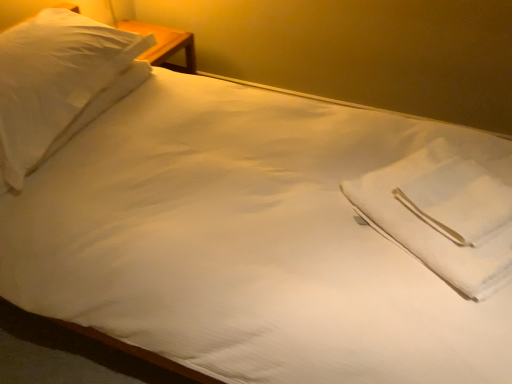
What do you see at coordinates (442, 216) in the screenshot? The width and height of the screenshot is (512, 384). I see `white cotton cloth at center` at bounding box center [442, 216].

You are a GUI agent. You are given a task and a screenshot of the screen. Output one action in this format:
    pyautogui.click(x=<x>, y=<y>)
    Task: Click on the white cotton cloth at center
    
    Given the screenshot: What is the action you would take?
    coord(442,216)

Where is `white soft pillow at upper left`? Image resolution: width=512 pixels, height=384 pixels. white soft pillow at upper left is located at coordinates (59, 84).

This screenshot has height=384, width=512. What do you see at coordinates (59, 84) in the screenshot?
I see `white soft pillow at upper left` at bounding box center [59, 84].

Find the location of a particular element. This screenshot has width=512, height=384. white cotton cloth at center is located at coordinates (442, 216).

Consider the image. Would you say white soft pillow at upper left is to the left or to the right of white cotton cloth at center in the picture?

Clearly, white soft pillow at upper left is on the left of white cotton cloth at center in the image.

Is white soft pillow at upper left positioned behind white cotton cloth at center?

Yes.

Which is behind, point (33, 26) or point (379, 171)?

The point (33, 26) is behind.

From the image's perspective, relative to white cotton cloth at center, is white soft pillow at upper left above or below?

Based on their image positions, white soft pillow at upper left is located above white cotton cloth at center.

From a real-world perspective, who is located lower, white soft pillow at upper left or white cotton cloth at center?

From a 3D spatial view, white soft pillow at upper left is below.

Based on the photo, considering the sizes of white soft pillow at upper left and white cotton cloth at center in the image, is white soft pillow at upper left wider or thinner than white cotton cloth at center?

Clearly, white soft pillow at upper left has more width compared to white cotton cloth at center.

Can you confirm if white soft pillow at upper left is shorter than white cotton cloth at center?

Incorrect, the height of white soft pillow at upper left does not fall short of that of white cotton cloth at center.

Considering the sizes of objects white soft pillow at upper left and white cotton cloth at center in the image provided, who is smaller, white soft pillow at upper left or white cotton cloth at center?

With smaller size is white cotton cloth at center.

Choose the correct answer: Is white soft pillow at upper left inside white cotton cloth at center or outside it?

white soft pillow at upper left exists outside the volume of white cotton cloth at center.

From the picture: Is white soft pillow at upper left directly adjacent to white cotton cloth at center?

No, white soft pillow at upper left is not next to white cotton cloth at center.

Does white soft pillow at upper left turn towards white cotton cloth at center?

No.

Can you tell me how much white soft pillow at upper left and white cotton cloth at center differ in facing direction?

The angular difference between white soft pillow at upper left and white cotton cloth at center is 180 degrees.

At what (x,y) coordinates should I click in order to perform the action: click on pillow that appears below the white cotton cloth at center (from a real-world perspective). Please return your answer as a coordinate pair (x, y). This screenshot has height=384, width=512. Looking at the image, I should click on 59,84.

Does white cotton cloth at center appear on the left side of white soft pillow at upper left?

In fact, white cotton cloth at center is to the right of white soft pillow at upper left.

Considering the relative positions of white cotton cloth at center and white soft pillow at upper left in the image provided, is white cotton cloth at center in front of white soft pillow at upper left?

Yes.

Considering the points (414, 169) and (31, 120), which point is behind, point (414, 169) or point (31, 120)?

Point (414, 169)

From the image's perspective, between white cotton cloth at center and white soft pillow at upper left, which one is located above?

white soft pillow at upper left, from the image's perspective.

From a real-world perspective, is white cotton cloth at center located beneath white soft pillow at upper left?

Incorrect, from a real-world perspective, white cotton cloth at center is higher than white soft pillow at upper left.

Is white cotton cloth at center wider or thinner than white soft pillow at upper left?

white cotton cloth at center is thinner than white soft pillow at upper left.

Considering the sizes of objects white cotton cloth at center and white soft pillow at upper left in the image provided, who is shorter, white cotton cloth at center or white soft pillow at upper left?

white cotton cloth at center is shorter.

Considering the relative sizes of white cotton cloth at center and white soft pillow at upper left in the image provided, is white cotton cloth at center smaller than white soft pillow at upper left?

Yes.

Do you think white cotton cloth at center is within white soft pillow at upper left, or outside of it?

The correct answer is: outside.

Is white cotton cloth at center beside white soft pillow at upper left?

There is a gap between white cotton cloth at center and white soft pillow at upper left.

Could you tell me if white cotton cloth at center is facing white soft pillow at upper left?

No, white cotton cloth at center is not oriented towards white soft pillow at upper left.

You are a GUI agent. You are given a task and a screenshot of the screen. Output one action in this format:
    pyautogui.click(x=<x>, y=<y>)
    Task: Click on the pillow located on the left of white cotton cloth at center
    The height and width of the screenshot is (384, 512).
    Given the screenshot: What is the action you would take?
    pyautogui.click(x=59, y=84)

The image size is (512, 384). I want to click on pillow located behind the white cotton cloth at center, so click(x=59, y=84).

Find the location of a particular element. This screenshot has width=512, height=384. cloth on the right of white soft pillow at upper left is located at coordinates (442, 216).